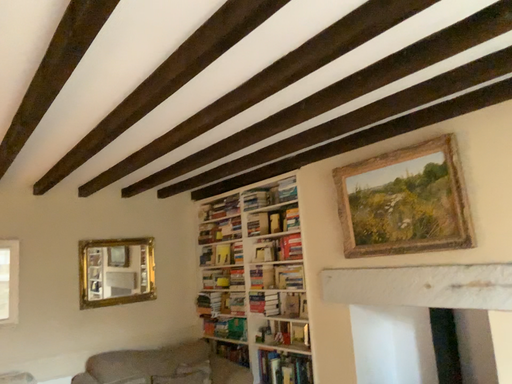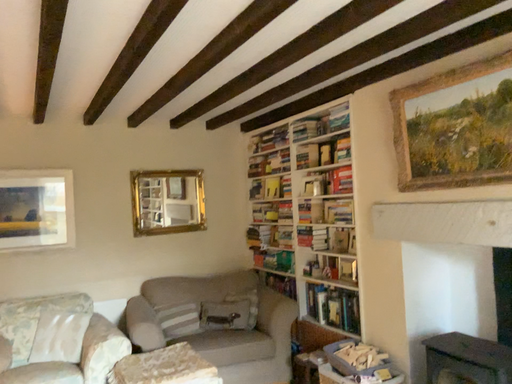
Question: How did the camera likely rotate when shooting the video?

Choices:
 (A) rotated upward
 (B) rotated downward

Answer: (B)